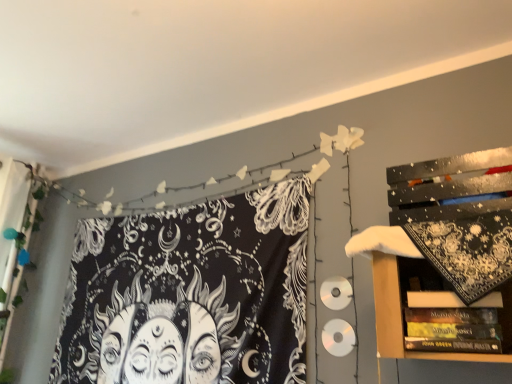
Question: Is point (425, 276) closer or farther from the camera than point (150, 281)?

Choices:
 (A) farther
 (B) closer

Answer: (B)

Question: From the image's perspective, relative to black printed fabric at upper left, is hardcover books at lower right above or below?

Choices:
 (A) below
 (B) above

Answer: (B)

Question: Is hardcover books at lower right bigger or smaller than black printed fabric at upper left?

Choices:
 (A) small
 (B) big

Answer: (A)

Question: Is black printed fabric at upper left to the left or to the right of hardcover books at lower right in the image?

Choices:
 (A) right
 (B) left

Answer: (B)

Question: Considering their positions, is black printed fabric at upper left located in front of or behind hardcover books at lower right?

Choices:
 (A) front
 (B) behind

Answer: (B)

Question: Is black printed fabric at upper left taller or shorter than hardcover books at lower right?

Choices:
 (A) tall
 (B) short

Answer: (A)

Question: Is black printed fabric at upper left spatially inside hardcover books at lower right, or outside of it?

Choices:
 (A) outside
 (B) inside

Answer: (A)